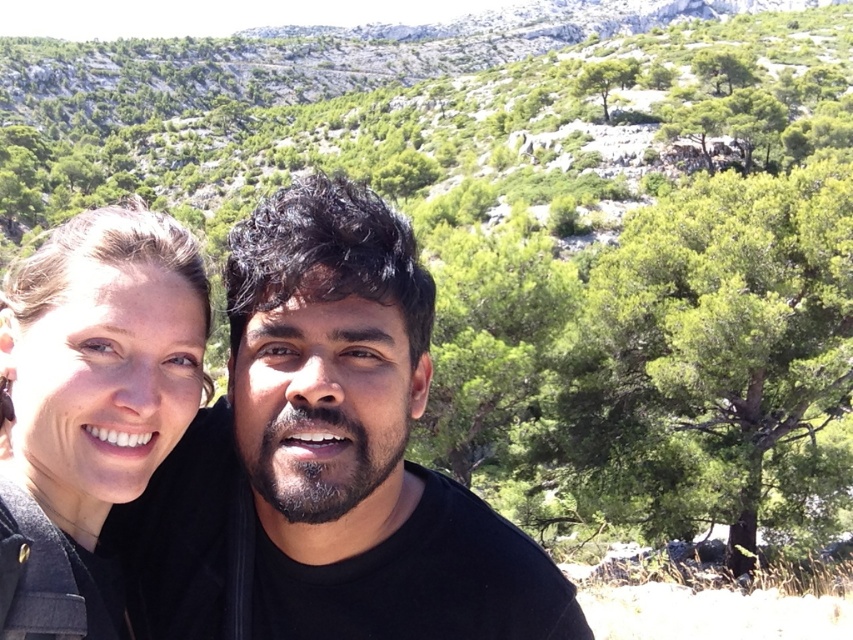
The width and height of the screenshot is (853, 640). What do you see at coordinates (90, 404) in the screenshot?
I see `matte black jacket at left` at bounding box center [90, 404].

Can you confirm if matte black jacket at left is taller than green leafy tree at upper center?

In fact, matte black jacket at left may be shorter than green leafy tree at upper center.

What are the coordinates of `matte black jacket at left` in the screenshot? It's located at (90, 404).

Can you confirm if black matte shirt at center is taller than green leafy tree at upper right?

Incorrect, black matte shirt at center's height is not larger of green leafy tree at upper right's.

Does point (248, 394) lie behind point (672, 376)?

No, (248, 394) is closer to viewer.

Who is more forward, (248,561) or (799,474)?

Point (248,561)

This screenshot has width=853, height=640. Identify the location of black matte shirt at center. (326, 460).

Locate an element on the screen. This screenshot has width=853, height=640. green leafy tree at upper right is located at coordinates (708, 355).

Which is in front, point (688, 369) or point (68, 317)?

Point (68, 317) is more forward.

Identify the location of green leafy tree at upper right. Image resolution: width=853 pixels, height=640 pixels. (708, 355).